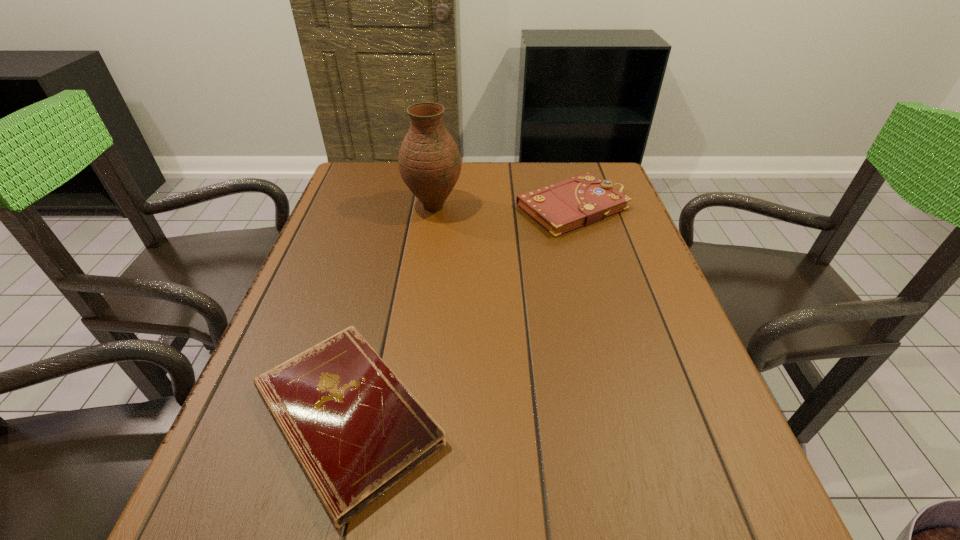
The image size is (960, 540). I want to click on vase, so click(429, 160).

Locate an element on the screen. the rightmost object is located at coordinates (581, 200).

Where is `the taller notebook`? the taller notebook is located at coordinates (581, 200).

I want to click on the shortest object, so click(356, 430).

The image size is (960, 540). Identify the location of the nearest object. (356, 430).

This screenshot has width=960, height=540. What are the coordinates of `free space located on the right of the vase` in the screenshot? It's located at (501, 207).

I want to click on vacant space located 0.370m on the front of the farther notebook, so click(x=612, y=348).

Where is `free region located 0.340m on the back of the shorter notebook`? free region located 0.340m on the back of the shorter notebook is located at coordinates coord(392,238).

The image size is (960, 540). What are the coordinates of `vase present at the far edge` in the screenshot? It's located at (429, 160).

Find the location of a particular element. notebook that is at the far edge is located at coordinates (581, 200).